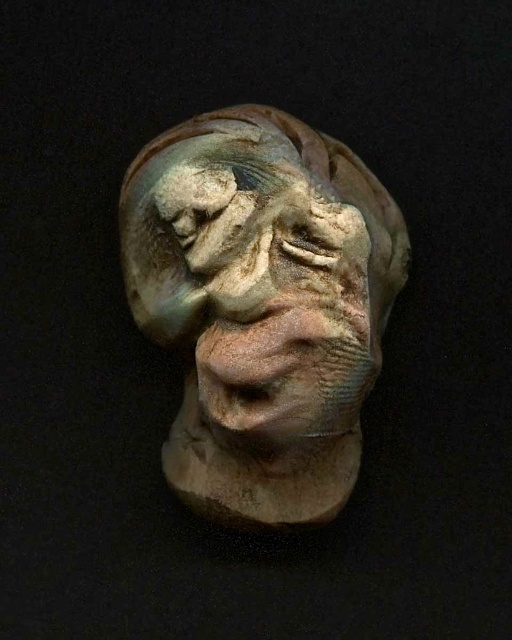
Is matte clay sculpture at center closer to camera compared to earthy clay sculpture at center?

No, matte clay sculpture at center is behind earthy clay sculpture at center.

Between point (344, 252) and point (240, 364), which one is positioned behind?

Positioned behind is point (344, 252).

Where is `matte clay sculpture at center`? The image size is (512, 640). matte clay sculpture at center is located at coordinates (263, 305).